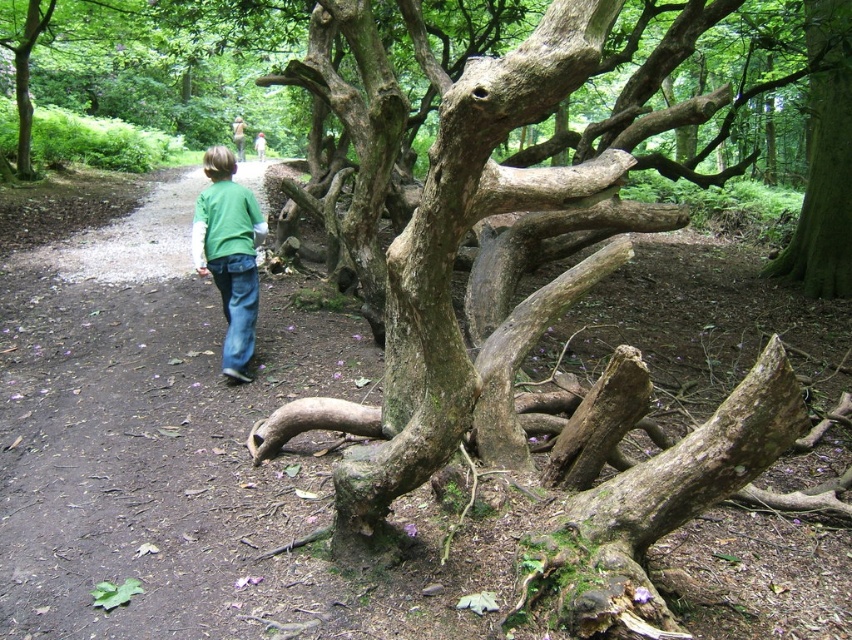
You are a photographer trying to capture the entire scene in one shot. Given that the green rough bark tree at upper right and the blue denim jeans at center are both in your frame, which object would require you to adjust your camera angle to include its full width?

The green rough bark tree at upper right has a larger width than the blue denim jeans at center, so you would need to adjust your camera angle to include its full width.

You are a hiker who wants to take a photo of both the green rough bark tree at upper right and the green matte shirt at center. Since you want both to be fully visible in the frame, will you need to adjust your camera angle to include both?

The green rough bark tree at upper right is taller than the green matte shirt at center, so you will need to adjust your camera angle to ensure both are fully visible in the frame.